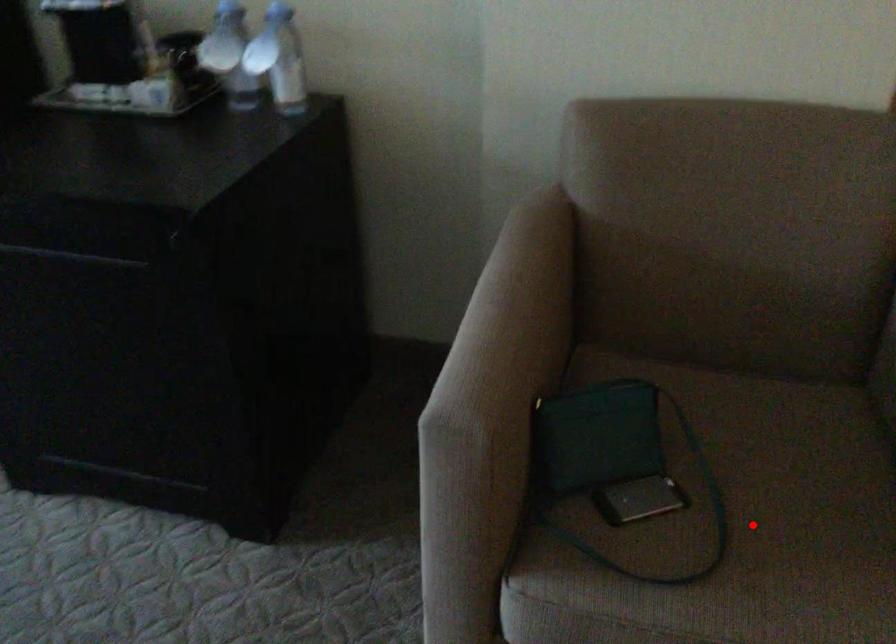
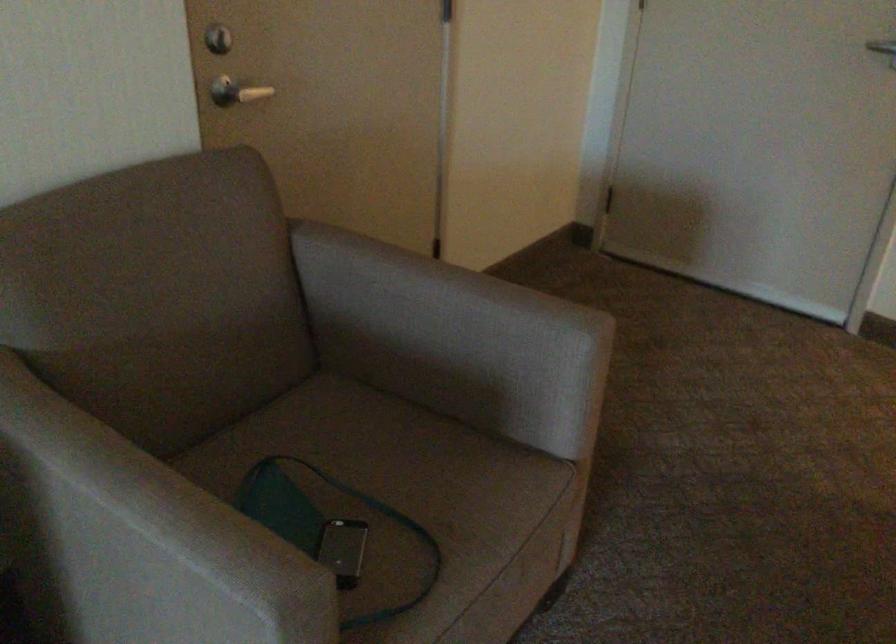
Where in the second image is the point corresponding to the highlighted location from the first image?

(412, 505)